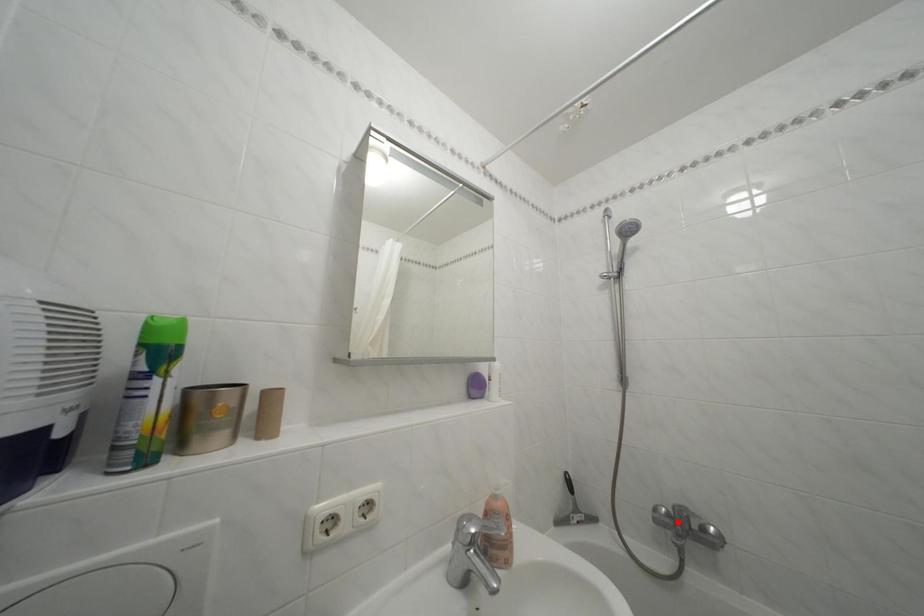
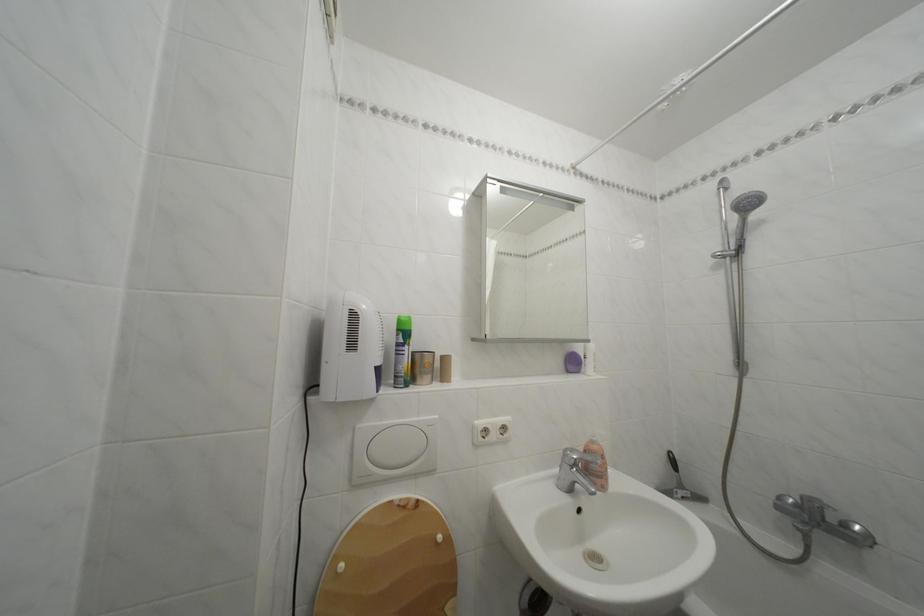
Where in the second image is the point corresponding to the highlighted location from the first image?

(806, 512)